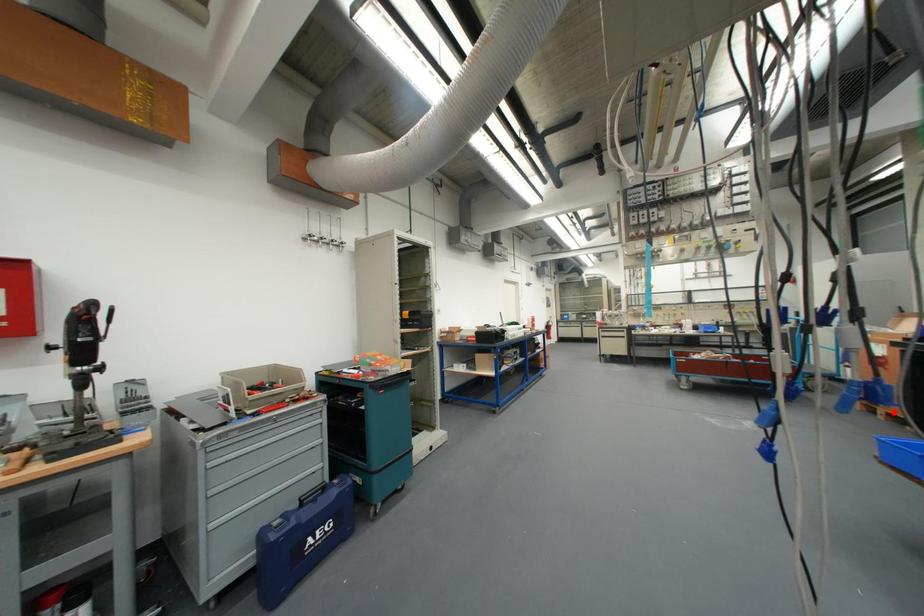
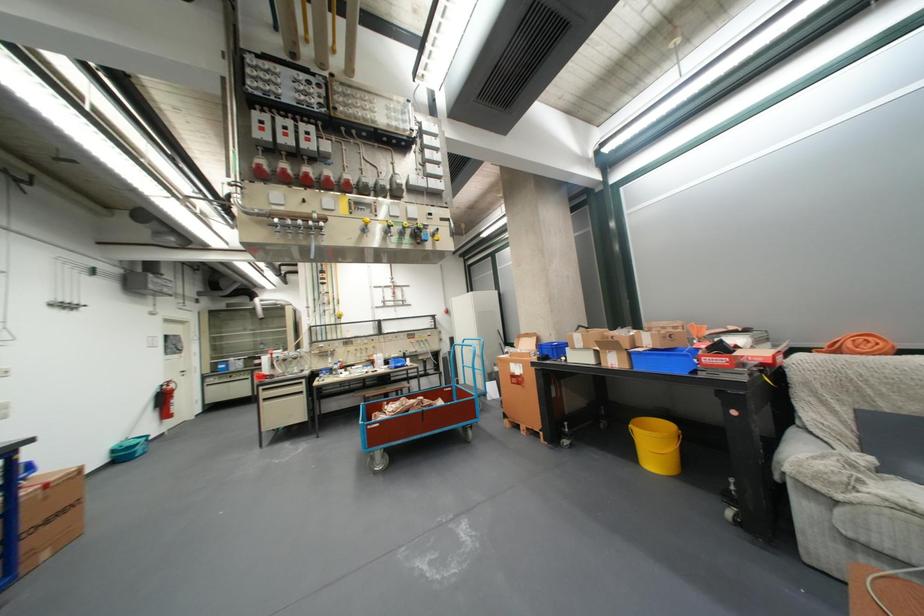
Locate, in the second image, the point that corresponds to the highlighted location in the first image.

(535, 428)